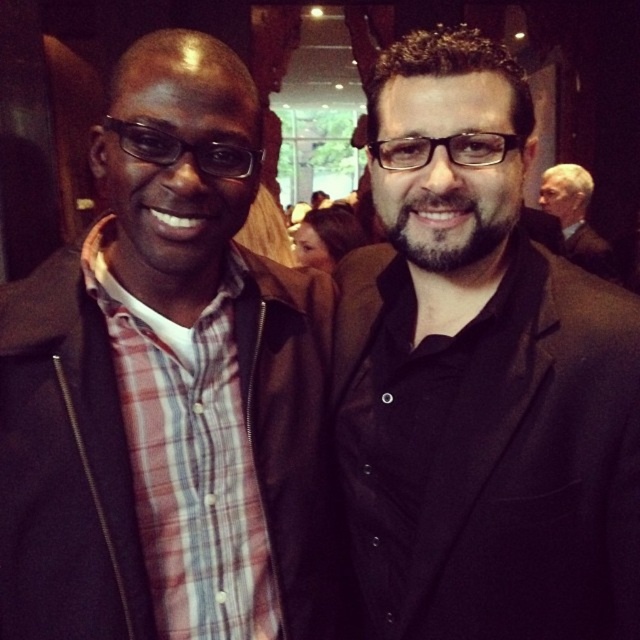
Question: Which object appears farthest from the camera in this image?

Choices:
 (A) gray suit at upper right
 (B) black plastic glasses at left
 (C) transparent plastic glasses at center
 (D) plaid shirt at left

Answer: (A)

Question: Is black matte suit at center below gray suit at upper right?

Choices:
 (A) yes
 (B) no

Answer: (A)

Question: Observing the image, what is the correct spatial positioning of plaid shirt at left in reference to transparent plastic glasses at center?

Choices:
 (A) right
 (B) left

Answer: (B)

Question: Is plaid shirt at left bigger than transparent plastic glasses at center?

Choices:
 (A) yes
 (B) no

Answer: (A)

Question: Which of the following is the farthest from the observer?

Choices:
 (A) black plastic glasses at left
 (B) plaid shirt at left
 (C) transparent plastic glasses at center

Answer: (C)

Question: Considering the real-world distances, which object is farthest from the black plastic glasses at left?

Choices:
 (A) black matte suit at center
 (B) gray suit at upper right
 (C) transparent plastic glasses at center

Answer: (B)